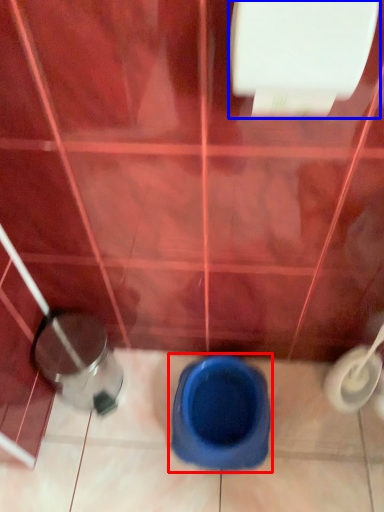
Question: Which point is further to the camera, toilet (highlighted by a red box) or toilet paper (highlighted by a blue box)?

Choices:
 (A) toilet
 (B) toilet paper

Answer: (A)